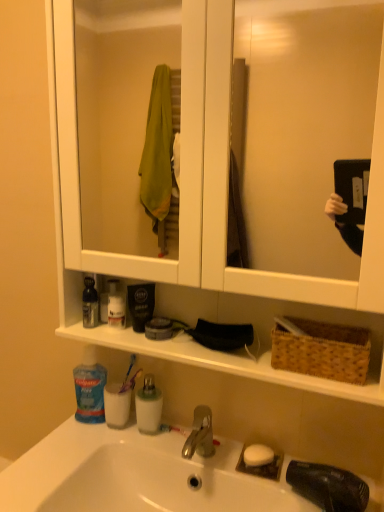
At what (x,y) coordinates should I click in order to perform the action: click on vacant space that is in between clear plastic container at center and white matte soap at center. Please return your answer as a coordinate pair (x, y). The image size is (384, 512). Looking at the image, I should click on (200, 448).